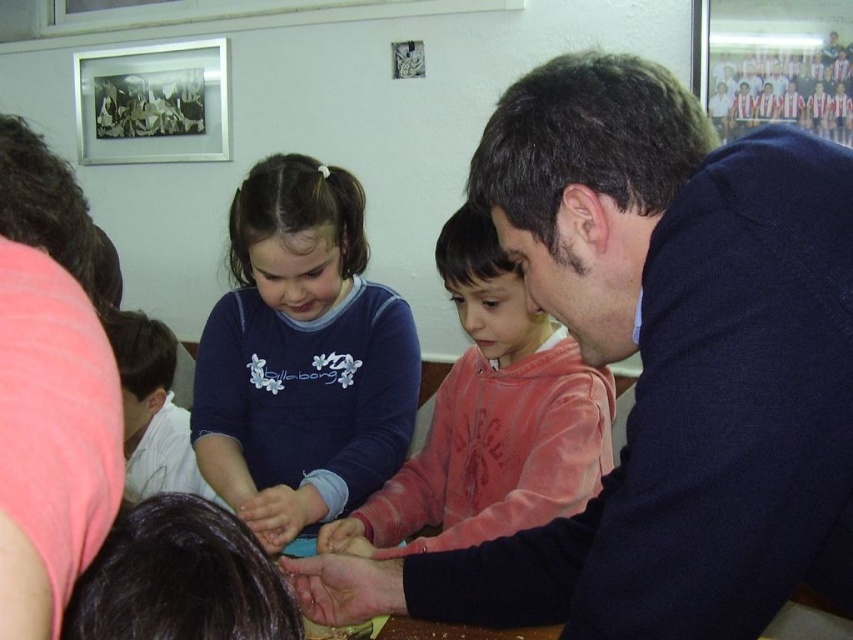
Question: Which object appears farthest from the camera in this image?

Choices:
 (A) pink fabric shirt at upper left
 (B) pink fleece sweater at center

Answer: (B)

Question: Can you confirm if dark blue sweater at center is wider than matte blue shirt at center?

Choices:
 (A) yes
 (B) no

Answer: (A)

Question: Which point is closer to the camera?

Choices:
 (A) (225, 426)
 (B) (604, 508)
 (C) (56, 241)
 (D) (440, 424)

Answer: (C)

Question: Which object is positioned closest to the pink fleece sweater at center?

Choices:
 (A) matte blue shirt at center
 (B) dark blue sweater at center

Answer: (A)

Question: Where is dark blue sweater at center located in relation to pink fabric shirt at upper left in the image?

Choices:
 (A) right
 (B) left

Answer: (A)

Question: Is dark blue sweater at center wider than pink fleece sweater at center?

Choices:
 (A) yes
 (B) no

Answer: (A)